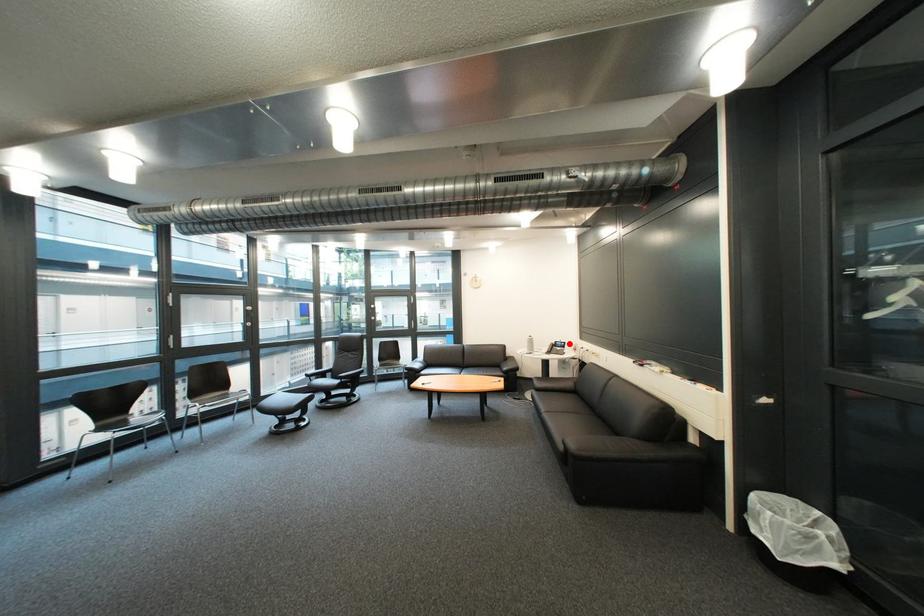
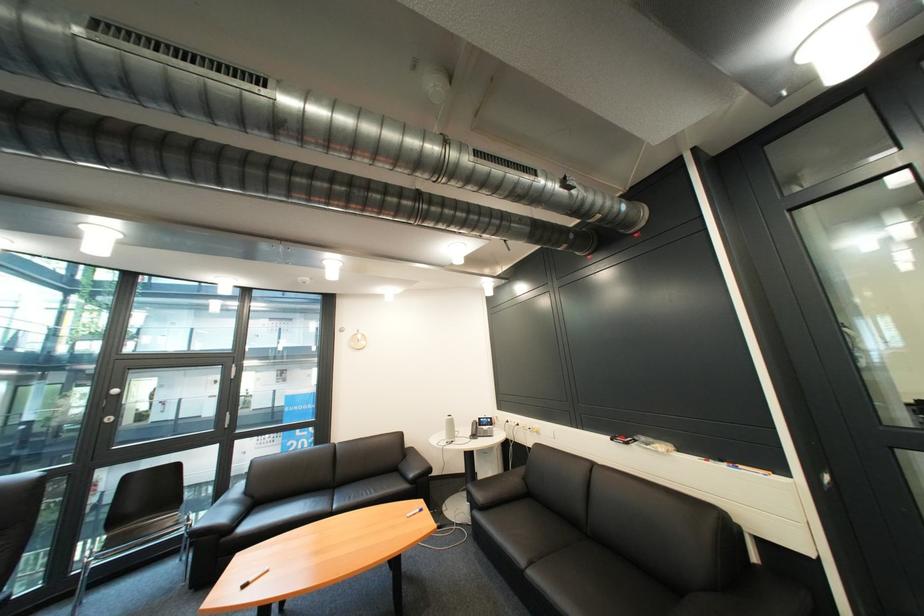
Locate, in the second image, the point that corresponds to the highlighted location in the first image.

(492, 419)